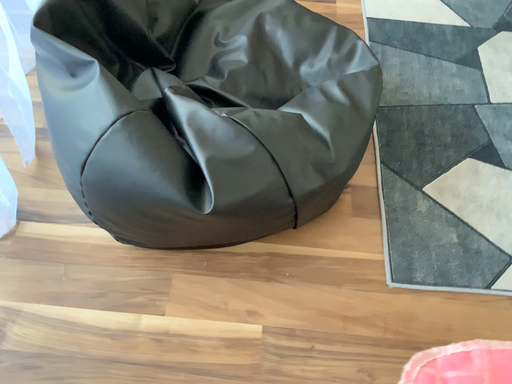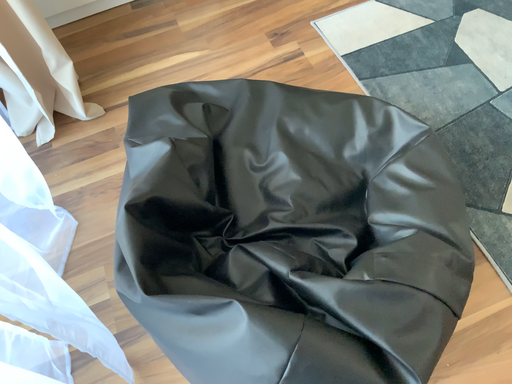
Question: How did the camera likely rotate when shooting the video?

Choices:
 (A) rotated right
 (B) rotated left

Answer: (A)